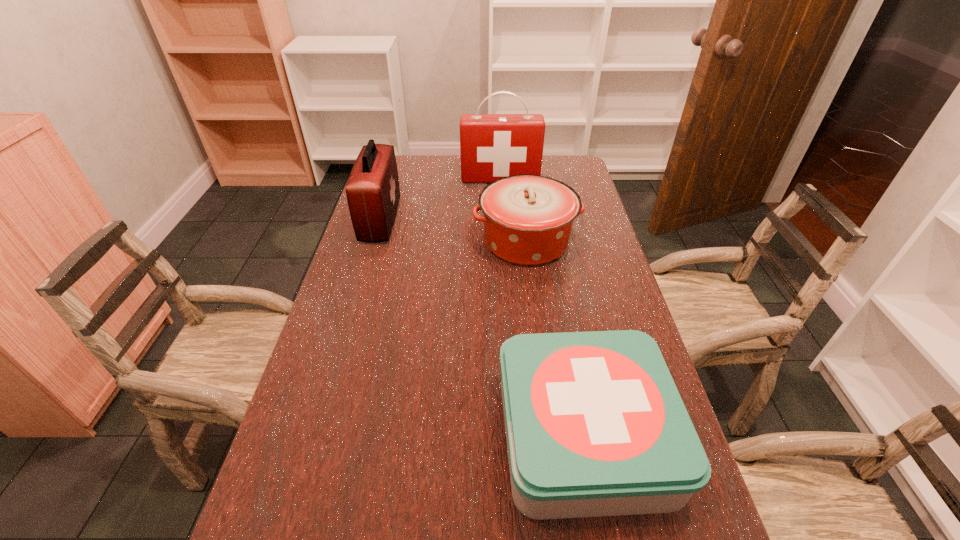
Find the location of a particular element. The image size is (960, 540). the farthest first-aid kit is located at coordinates (492, 146).

You are a GUI agent. You are given a task and a screenshot of the screen. Output one action in this format:
    pyautogui.click(x=<x>, y=<y>)
    Task: Click on the tallest object
    This screenshot has width=960, height=540.
    Given the screenshot: What is the action you would take?
    pyautogui.click(x=492, y=146)

Where is `the third shortest object`? the third shortest object is located at coordinates (372, 190).

This screenshot has height=540, width=960. Find the location of `the second farthest first-aid kit`. the second farthest first-aid kit is located at coordinates (372, 190).

Locate an element on the screen. The width and height of the screenshot is (960, 540). the third tallest object is located at coordinates (528, 219).

The image size is (960, 540). Find the location of `the nearest first-aid kit`. the nearest first-aid kit is located at coordinates (595, 426).

This screenshot has height=540, width=960. In order to click on the nearest object in this screenshot , I will do `click(595, 426)`.

Locate an element on the screen. This screenshot has width=960, height=540. vacant point located 0.260m on the front face of the farthest object is located at coordinates (503, 226).

Image resolution: width=960 pixels, height=540 pixels. What are the coordinates of `vacant space located on the side of the third shortest object with the cross symbol` in the screenshot? It's located at (516, 220).

This screenshot has width=960, height=540. What are the coordinates of `vacant region located on the left of the second shortest object` in the screenshot? It's located at (375, 241).